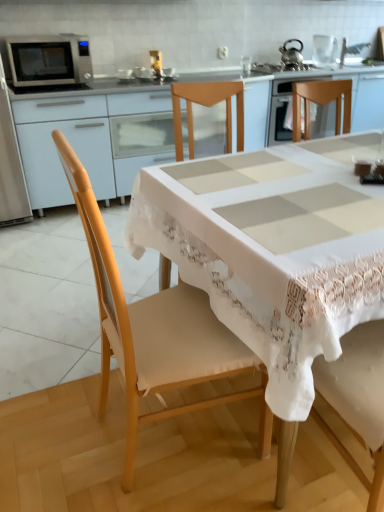
Question: Is white ceramic sink at upper center to the left or to the right of wooden chair at center in the image?

Choices:
 (A) left
 (B) right

Answer: (B)

Question: Looking at their shapes, would you say white ceramic sink at upper center is wider or thinner than wooden chair at center?

Choices:
 (A) wide
 (B) thin

Answer: (B)

Question: Estimate the real-world distances between objects in this image. Which object is farther from the white lace tablecloth at center?

Choices:
 (A) silver metallic microwave at upper left
 (B) metallic gold toaster at upper center, the 1th appliance positioned from the bottom
 (C) wooden chair at center
 (D) matte white cabinet at upper left
 (E) white ceramic sink at upper center

Answer: (E)

Question: Which is nearer to the white ceramic sink at upper center?

Choices:
 (A) metallic gold toaster at upper center, the 1th appliance in the left-to-right sequence
 (B) silver metallic microwave at upper left
 (C) clear glass kettle at upper center, the first appliance when ordered from back to front
 (D) white lace tablecloth at center
 (E) wooden chair at center

Answer: (C)